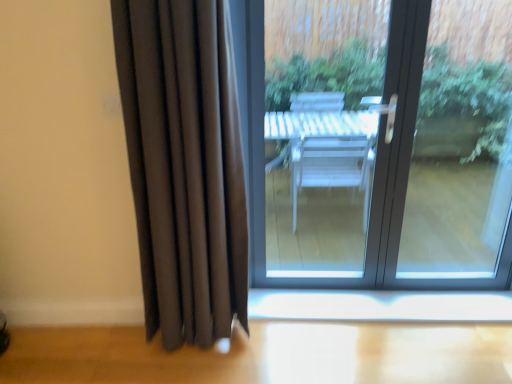
Where is `empty space that is to the right of matte black curtain at left`? empty space that is to the right of matte black curtain at left is located at coordinates (248, 350).